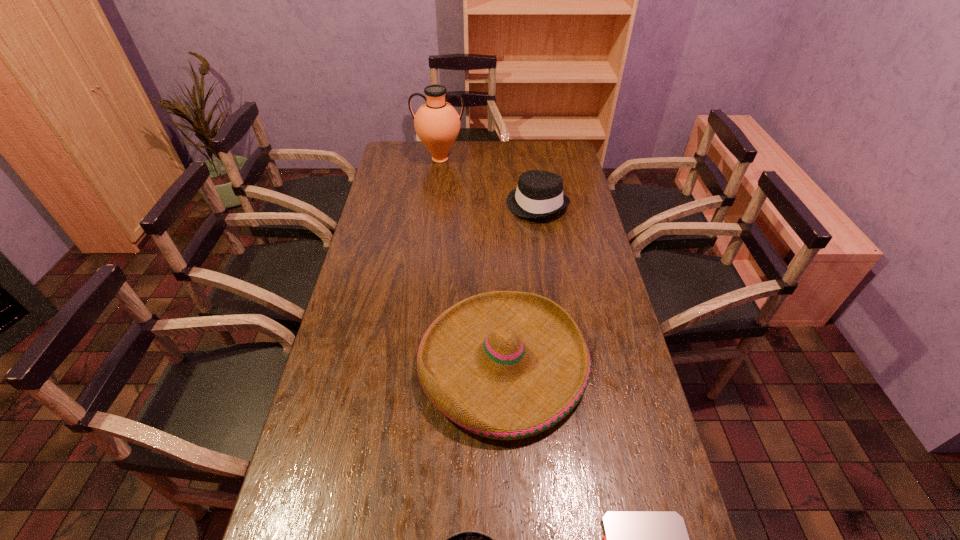
Locate an element on the screen. The image size is (960, 540). object identified as the closest to the shortest object is located at coordinates (506, 365).

What are the coordinates of `free space that satisfies the following two spatial constraints: 1. on the back side of the fourth nearest object; 2. on the left side of the sombrero` in the screenshot? It's located at [496, 205].